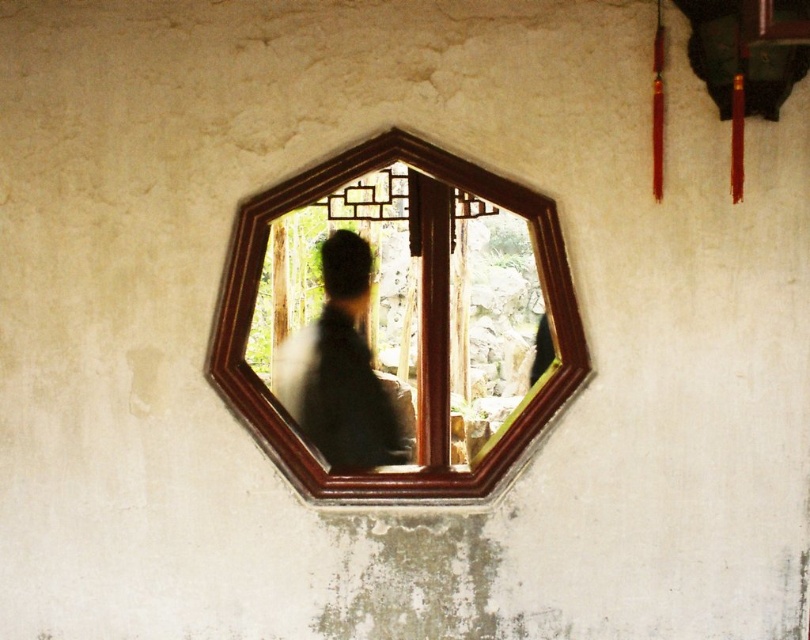
Question: From the image, what is the correct spatial relationship of wooden frame mirror at center in relation to silhouette fabric at center?

Choices:
 (A) left
 (B) right

Answer: (B)

Question: Among these objects, which one is nearest to the camera?

Choices:
 (A) silhouette fabric at center
 (B) wooden frame mirror at center

Answer: (B)

Question: Can you confirm if wooden frame mirror at center is bigger than silhouette fabric at center?

Choices:
 (A) yes
 (B) no

Answer: (B)

Question: Can you confirm if wooden frame mirror at center is bigger than silhouette fabric at center?

Choices:
 (A) no
 (B) yes

Answer: (A)